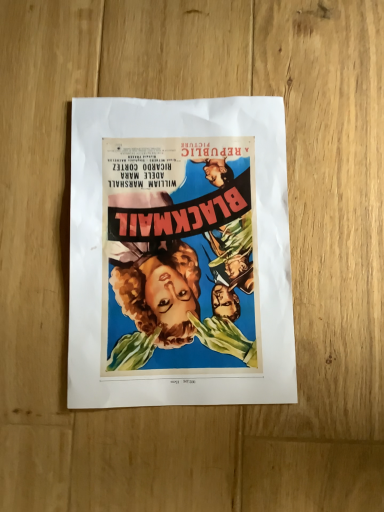
You are a GUI agent. You are given a task and a screenshot of the screen. Output one action in this format:
    pyautogui.click(x=<x>, y=<y>)
    Task: Click on the vacant area on top of vibrant paper poster at center (from a real-world perspective)
    The width and height of the screenshot is (384, 512).
    Given the screenshot: What is the action you would take?
    pyautogui.click(x=181, y=236)